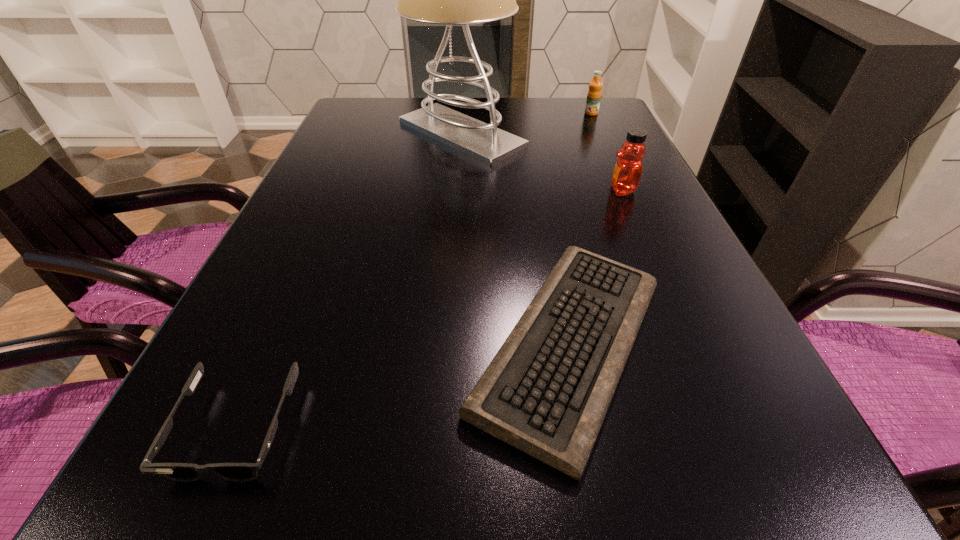
You are a GUI agent. You are given a task and a screenshot of the screen. Output one action in this format:
    pyautogui.click(x=<x>, y=<y>)
    Task: Click on the object at the near left corner
    The height and width of the screenshot is (540, 960).
    Given the screenshot: What is the action you would take?
    pyautogui.click(x=182, y=472)

Where is `object present at the far right corner`? object present at the far right corner is located at coordinates (594, 93).

In order to click on object at the near right corner in this screenshot , I will do `click(546, 392)`.

In the image, there is a desktop. Identify the location of vacant space at the far edge. The width and height of the screenshot is (960, 540). (522, 122).

In the image, there is a desktop. Where is `vacant space at the left edge`? vacant space at the left edge is located at coordinates (338, 197).

Find the location of a particular element. This screenshot has height=540, width=960. free space at the right edge is located at coordinates (735, 426).

Where is `free space between the third shortest object and the sunglasses`? The width and height of the screenshot is (960, 540). free space between the third shortest object and the sunglasses is located at coordinates (414, 271).

Locate an element on the screen. The height and width of the screenshot is (540, 960). empty space that is in between the leftmost object and the honey is located at coordinates (429, 309).

This screenshot has height=540, width=960. What are the coordinates of `vacant area between the computer keyboard and the orange juice` in the screenshot? It's located at (581, 229).

The image size is (960, 540). What are the coordinates of `vacant space that is in between the table lamp and the leftmost object` in the screenshot? It's located at (348, 281).